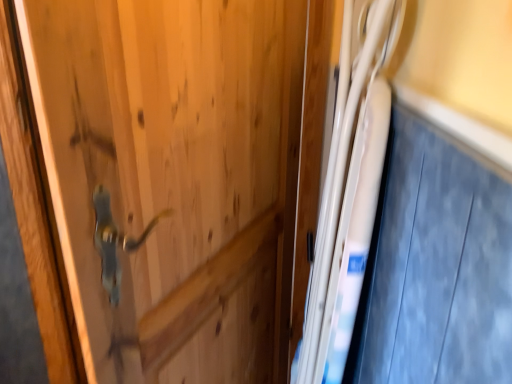
Question: Is white glossy bed at right completely or partially outside of white glossy fridge at right?

Choices:
 (A) yes
 (B) no

Answer: (A)

Question: Is there a large distance between white glossy bed at right and white glossy fridge at right?

Choices:
 (A) no
 (B) yes

Answer: (A)

Question: Is white glossy bed at right with white glossy fridge at right?

Choices:
 (A) yes
 (B) no

Answer: (B)

Question: From the image's perspective, is white glossy bed at right below white glossy fridge at right?

Choices:
 (A) yes
 (B) no

Answer: (B)

Question: Can you confirm if white glossy bed at right is positioned to the right of white glossy fridge at right?

Choices:
 (A) no
 (B) yes

Answer: (B)

Question: Considering the relative sizes of white glossy bed at right and white glossy fridge at right in the image provided, is white glossy bed at right thinner than white glossy fridge at right?

Choices:
 (A) no
 (B) yes

Answer: (B)

Question: Does white glossy fridge at right appear on the right side of white glossy bed at right?

Choices:
 (A) no
 (B) yes

Answer: (A)

Question: From the image's perspective, is white glossy fridge at right located above white glossy bed at right?

Choices:
 (A) no
 (B) yes

Answer: (A)

Question: Can you confirm if white glossy fridge at right is wider than white glossy bed at right?

Choices:
 (A) yes
 (B) no

Answer: (A)

Question: Can you confirm if white glossy fridge at right is shorter than white glossy bed at right?

Choices:
 (A) yes
 (B) no

Answer: (B)

Question: Is white glossy fridge at right placed right next to white glossy bed at right?

Choices:
 (A) no
 (B) yes

Answer: (A)

Question: Is white glossy fridge at right not close to white glossy bed at right?

Choices:
 (A) yes
 (B) no

Answer: (B)

Question: From a real-world perspective, is white glossy fridge at right physically located above or below white glossy bed at right?

Choices:
 (A) above
 (B) below

Answer: (B)